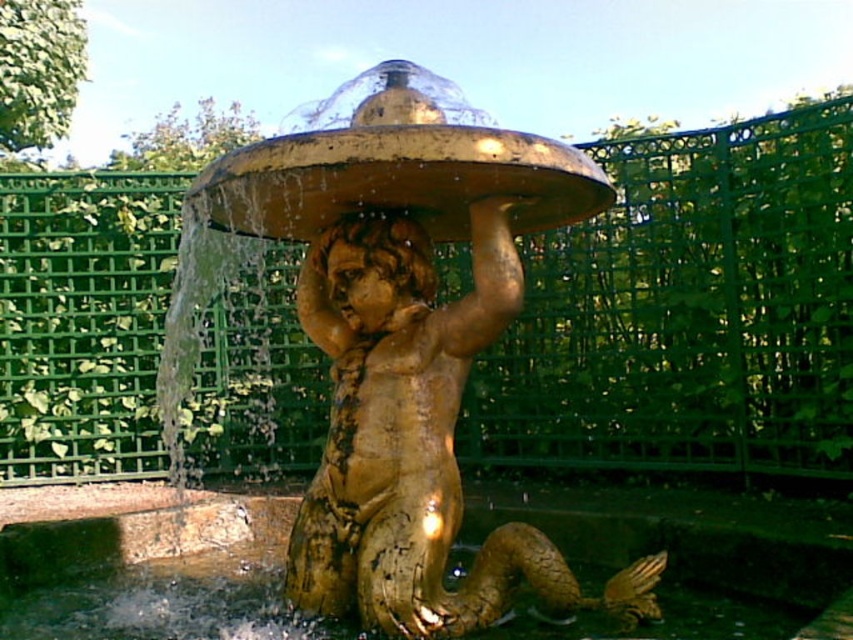
You are a photographer standing at a certain distance from the gold textured cherub at center. You want to capture a closeup shot of the statue without getting too wet from the cascading water. Considering the water is splashing up to 1 meter from the basin, is your current position safe?

The gold textured cherub at center is 2.78 meters away from the camera. Since the water splashes up to 1 meter from the basin, your position at 2.78 meters is safe as it is beyond the splash range.

You are standing in the garden and see the gold textured cherub at center and the gold metallic water at center. Which object is positioned to the left?

The gold metallic water at center is positioned to the left of the gold textured cherub at center.

You are standing in front of the fountain and want to take a photo. You notice two points marked on the statue, one at point (x=454, y=124) and the other at point (x=376, y=296). Which point is closer to your camera lens?

Point (x=454, y=124) is closer to the camera than point (x=376, y=296).